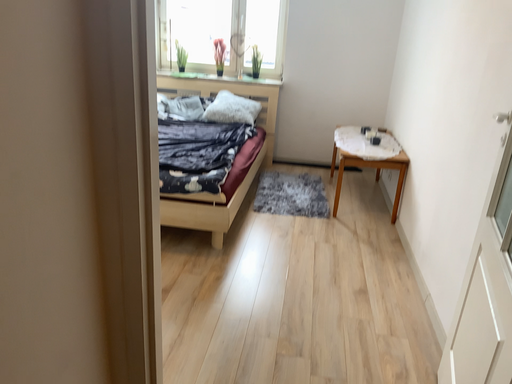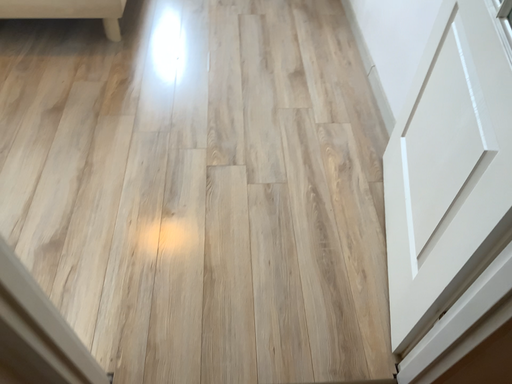
Question: Which way did the camera rotate in the video?

Choices:
 (A) rotated right
 (B) rotated left

Answer: (A)